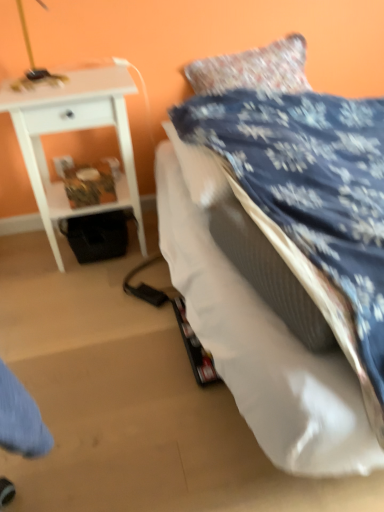
Find the location of a particular element. Image resolution: width=384 pixels, height=512 pixels. blue fabric bed at upper right is located at coordinates (282, 249).

Measure the distance between blue fabric bed at upper right and camera.

They are 29.55 inches apart.

This screenshot has height=512, width=384. What do you see at coordinates (282, 249) in the screenshot?
I see `blue fabric bed at upper right` at bounding box center [282, 249].

In order to face white glossy nightstand at upper left, should I rotate leftwards or rightwards?

Turn left approximately 13.735 degrees to face it.

The image size is (384, 512). What are the coordinates of `white glossy nightstand at upper left` in the screenshot? It's located at (74, 130).

What do you see at coordinates (74, 130) in the screenshot? I see `white glossy nightstand at upper left` at bounding box center [74, 130].

Where is `blue fabric bed at upper right`? blue fabric bed at upper right is located at coordinates pos(282,249).

Which object is positioned more to the right, blue fabric bed at upper right or white glossy nightstand at upper left?

blue fabric bed at upper right is more to the right.

Relative to white glossy nightstand at upper left, is blue fabric bed at upper right in front or behind?

Clearly, blue fabric bed at upper right is in front of white glossy nightstand at upper left.

Considering the points (336, 129) and (0, 108), which point is behind, point (336, 129) or point (0, 108)?

Positioned behind is point (336, 129).

From the image's perspective, which is below, blue fabric bed at upper right or white glossy nightstand at upper left?

blue fabric bed at upper right.

From a real-world perspective, is blue fabric bed at upper right positioned above or below white glossy nightstand at upper left?

blue fabric bed at upper right is below white glossy nightstand at upper left.

Is blue fabric bed at upper right wider than white glossy nightstand at upper left?

Indeed, blue fabric bed at upper right has a greater width compared to white glossy nightstand at upper left.

In terms of height, does blue fabric bed at upper right look taller or shorter compared to white glossy nightstand at upper left?

Considering their sizes, blue fabric bed at upper right has less height than white glossy nightstand at upper left.

Does blue fabric bed at upper right have a smaller size compared to white glossy nightstand at upper left?

Actually, blue fabric bed at upper right might be larger than white glossy nightstand at upper left.

From the picture: Would you say blue fabric bed at upper right contains white glossy nightstand at upper left?

No, white glossy nightstand at upper left is located outside of blue fabric bed at upper right.

Is blue fabric bed at upper right next to white glossy nightstand at upper left and touching it?

No, blue fabric bed at upper right is not beside white glossy nightstand at upper left.

Looking at this image, is blue fabric bed at upper right aimed at white glossy nightstand at upper left?

No, blue fabric bed at upper right is not oriented towards white glossy nightstand at upper left.

What's the angular difference between blue fabric bed at upper right and white glossy nightstand at upper left's facing directions?

The facing directions of blue fabric bed at upper right and white glossy nightstand at upper left are 0.527 degrees apart.

Where is `nightstand that is behind the blue fabric bed at upper right`? The width and height of the screenshot is (384, 512). nightstand that is behind the blue fabric bed at upper right is located at coordinates (74, 130).

Is white glossy nightstand at upper left at the left side of blue fabric bed at upper right?

Yes.

Which is behind, white glossy nightstand at upper left or blue fabric bed at upper right?

Positioned behind is white glossy nightstand at upper left.

Which is nearer, (x=45, y=120) or (x=305, y=327)?

Point (x=45, y=120) is farther from the camera than point (x=305, y=327).

From the image's perspective, does white glossy nightstand at upper left appear higher than blue fabric bed at upper right?

Indeed, from the image's perspective, white glossy nightstand at upper left is shown above blue fabric bed at upper right.

From a real-world perspective, is white glossy nightstand at upper left below blue fabric bed at upper right?

No.

Looking at this image, considering the relative sizes of white glossy nightstand at upper left and blue fabric bed at upper right in the image provided, is white glossy nightstand at upper left thinner than blue fabric bed at upper right?

Yes.

Between white glossy nightstand at upper left and blue fabric bed at upper right, which one has less height?

With less height is blue fabric bed at upper right.

Which of these two, white glossy nightstand at upper left or blue fabric bed at upper right, is smaller?

Smaller between the two is white glossy nightstand at upper left.

Is white glossy nightstand at upper left positioned beyond the bounds of blue fabric bed at upper right?

white glossy nightstand at upper left is positioned outside blue fabric bed at upper right.

Is white glossy nightstand at upper left next to blue fabric bed at upper right and touching it?

No, white glossy nightstand at upper left is not making contact with blue fabric bed at upper right.

Could you tell me if white glossy nightstand at upper left is turned towards blue fabric bed at upper right?

No, white glossy nightstand at upper left does not turn towards blue fabric bed at upper right.

The height and width of the screenshot is (512, 384). I want to click on nightstand above the blue fabric bed at upper right (from a real-world perspective), so click(74, 130).

In order to click on bed in front of the white glossy nightstand at upper left in this screenshot , I will do pyautogui.click(x=282, y=249).

You are a GUI agent. You are given a task and a screenshot of the screen. Output one action in this format:
    pyautogui.click(x=<x>, y=<y>)
    Task: Click on the bed below the white glossy nightstand at upper left (from a real-world perspective)
    Image resolution: width=384 pixels, height=512 pixels.
    Given the screenshot: What is the action you would take?
    pyautogui.click(x=282, y=249)